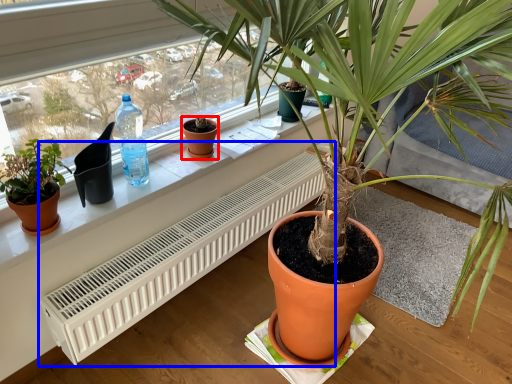
Question: Which of the following is the farthest to the observer, flowerpot (highlighted by a red box) or air conditioner (highlighted by a blue box)?

Choices:
 (A) flowerpot
 (B) air conditioner

Answer: (A)